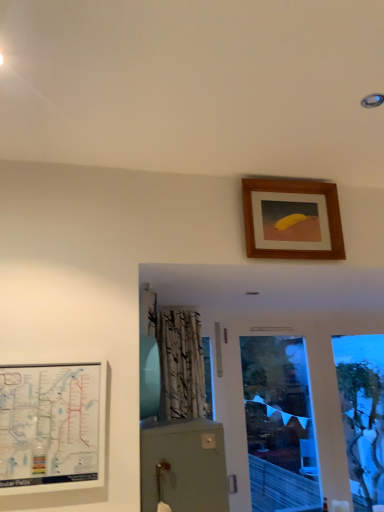
Question: In which direction should I rotate to look at wooden picture frame at upper center, placed as the 2th picture frame when sorted from left to right?

Choices:
 (A) right
 (B) left

Answer: (A)

Question: Is wooden picture frame at upper center, the 2th picture frame in the bottom-to-top sequence, far away from white matte subway map at lower left, arranged as the second picture frame when viewed from the top?

Choices:
 (A) no
 (B) yes

Answer: (B)

Question: Can you confirm if wooden picture frame at upper center, which is the 1th picture frame in back-to-front order, is shorter than white matte subway map at lower left, the 1th picture frame ordered from the bottom?

Choices:
 (A) yes
 (B) no

Answer: (A)

Question: Is wooden picture frame at upper center, which is the 1th picture frame in back-to-front order, oriented towards white matte subway map at lower left, the 1th picture frame ordered from the bottom?

Choices:
 (A) yes
 (B) no

Answer: (B)

Question: Considering the relative sizes of wooden picture frame at upper center, placed as the 2th picture frame when sorted from left to right, and white matte subway map at lower left, which is the second picture frame in back-to-front order, in the image provided, is wooden picture frame at upper center, placed as the 2th picture frame when sorted from left to right, bigger than white matte subway map at lower left, which is the second picture frame in back-to-front order,?

Choices:
 (A) no
 (B) yes

Answer: (B)

Question: Is wooden picture frame at upper center, placed as the 2th picture frame when sorted from left to right, wider than white matte subway map at lower left, which is the second picture frame in back-to-front order?

Choices:
 (A) no
 (B) yes

Answer: (B)

Question: Considering the relative sizes of wooden picture frame at upper center, acting as the first picture frame starting from the top, and white matte subway map at lower left, placed as the 1th picture frame when sorted from front to back, in the image provided, is wooden picture frame at upper center, acting as the first picture frame starting from the top, thinner than white matte subway map at lower left, placed as the 1th picture frame when sorted from front to back,?

Choices:
 (A) no
 (B) yes

Answer: (A)

Question: From a real-world perspective, is white matte subway map at lower left, which is the second picture frame in back-to-front order, over wooden picture frame at upper center, acting as the first picture frame starting from the top?

Choices:
 (A) no
 (B) yes

Answer: (A)

Question: From the image's perspective, is white matte subway map at lower left, placed as the 1th picture frame when sorted from front to back, located above wooden picture frame at upper center, the 1th picture frame when ordered from right to left?

Choices:
 (A) yes
 (B) no

Answer: (B)

Question: Can wooden picture frame at upper center, the 2th picture frame in the bottom-to-top sequence, be found inside white matte subway map at lower left, the 2th picture frame positioned from the right?

Choices:
 (A) no
 (B) yes

Answer: (A)

Question: Can you confirm if white matte subway map at lower left, which is the second picture frame in back-to-front order, is taller than wooden picture frame at upper center, acting as the first picture frame starting from the top?

Choices:
 (A) yes
 (B) no

Answer: (A)

Question: Does white matte subway map at lower left, the 2th picture frame positioned from the right, have a lesser height compared to wooden picture frame at upper center, the 1th picture frame when ordered from right to left?

Choices:
 (A) no
 (B) yes

Answer: (A)

Question: Is white matte subway map at lower left, which appears as the 1th picture frame when viewed from the left, thinner than wooden picture frame at upper center, the 1th picture frame when ordered from right to left?

Choices:
 (A) yes
 (B) no

Answer: (A)

Question: From the image's perspective, is white matte subway map at lower left, placed as the 1th picture frame when sorted from front to back, above or below wooden picture frame at upper center, placed as the 2th picture frame when sorted from left to right?

Choices:
 (A) above
 (B) below

Answer: (B)